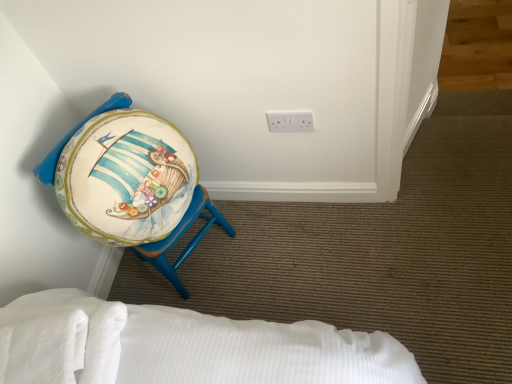
Question: Is white soft towel at lower left wider or thinner than matte painted stool at left?

Choices:
 (A) thin
 (B) wide

Answer: (A)

Question: Is point (96, 357) closer or farther from the camera than point (211, 213)?

Choices:
 (A) closer
 (B) farther

Answer: (A)

Question: Which object is the farthest from the white plastic electric outlet at upper center?

Choices:
 (A) white soft towel at lower left
 (B) matte painted stool at left

Answer: (A)

Question: Estimate the real-world distances between objects in this image. Which object is closer to the white plastic electric outlet at upper center?

Choices:
 (A) matte painted stool at left
 (B) white soft towel at lower left

Answer: (A)